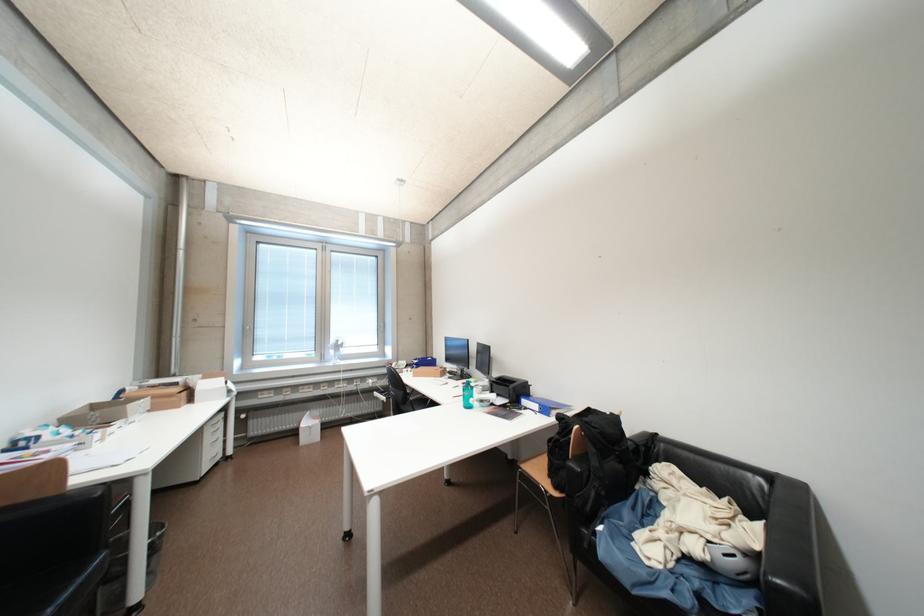
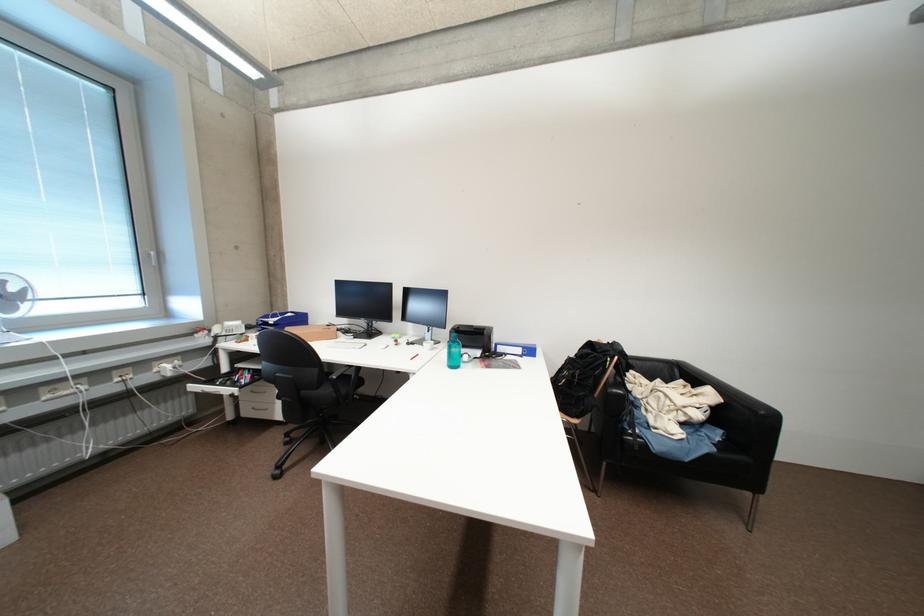
The point at (402, 368) is marked in the first image. Where is the corresponding point in the second image?

(225, 331)